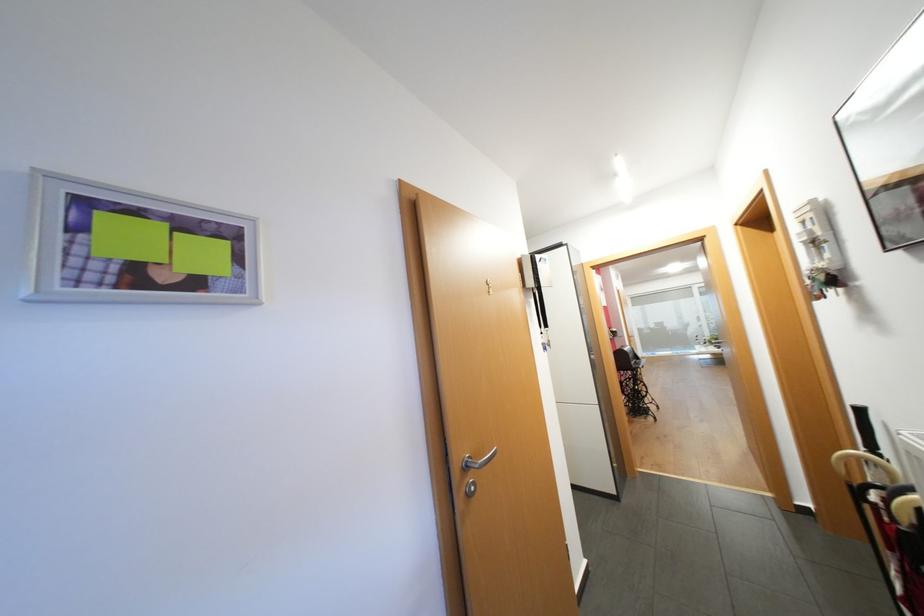
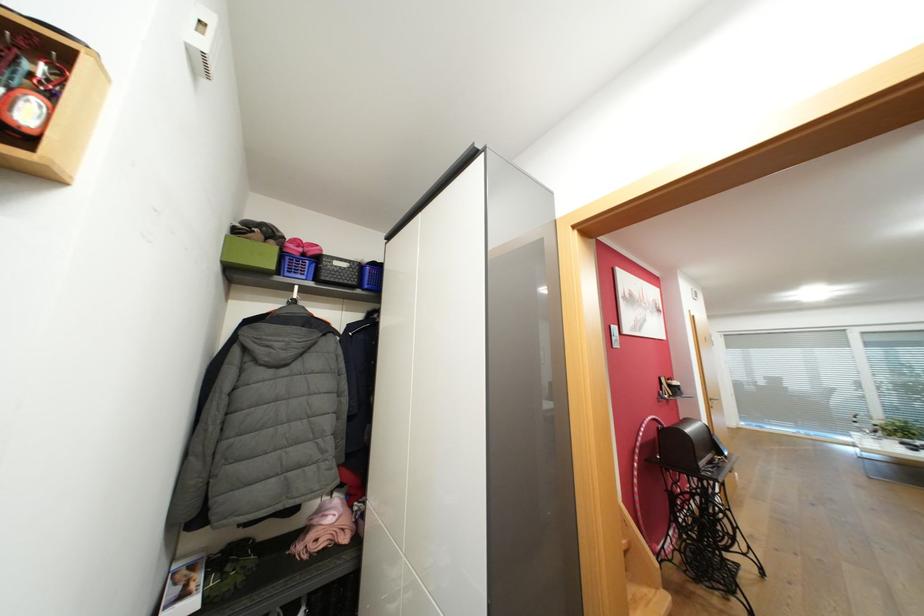
Locate, in the second image, the point that corresponds to (633,349) in the first image.

(696, 430)